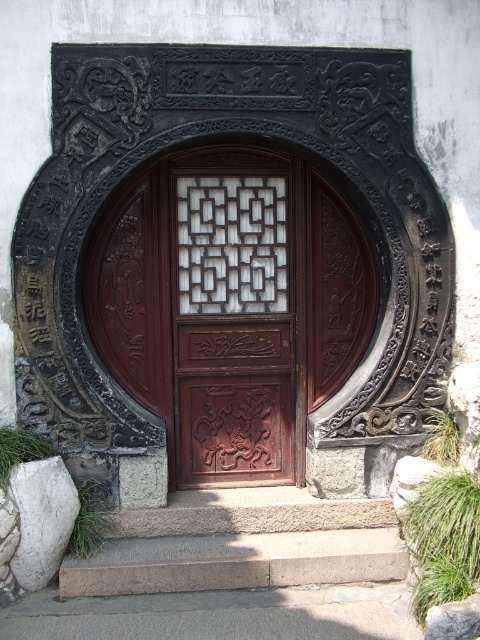
Is point (269, 188) farther from camera compared to point (200, 538)?

Yes, point (269, 188) is behind point (200, 538).

Does polished wood door at center appear over smooth stone steps at lower center?

Yes, polished wood door at center is above smooth stone steps at lower center.

Who is more distant from viewer, (105, 252) or (264, 492)?

Positioned behind is point (264, 492).

This screenshot has height=640, width=480. In order to click on polished wood door at center in this screenshot , I will do `click(230, 307)`.

Is polished wood door at center closer to camera compared to wooden carved door at center?

Yes, it is.

Image resolution: width=480 pixels, height=640 pixels. What do you see at coordinates (230, 307) in the screenshot? I see `polished wood door at center` at bounding box center [230, 307].

The width and height of the screenshot is (480, 640). In order to click on polished wood door at center in this screenshot , I will do `click(230, 307)`.

Is point (254, 160) farther from camera compared to point (23, 547)?

Yes, point (254, 160) is farther from viewer.

Who is shorter, polished wood door at center or white marble rock at lower left?

Standing shorter between the two is white marble rock at lower left.

Measure the distance between polished wood door at center and camera.

polished wood door at center and camera are 4.48 meters apart.

Identify the location of polished wood door at center. This screenshot has height=640, width=480. (230, 307).